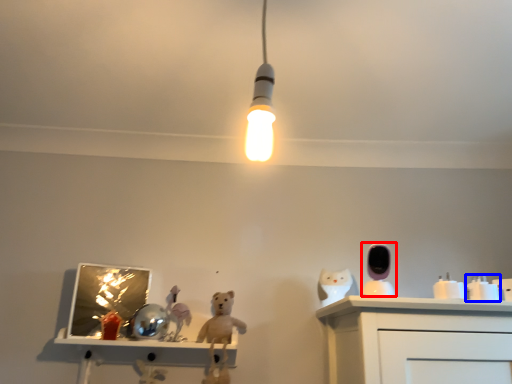
Question: Which of the following is the closest to the observer, toy (highlighted by a red box) or toy (highlighted by a blue box)?

Choices:
 (A) toy
 (B) toy

Answer: (A)